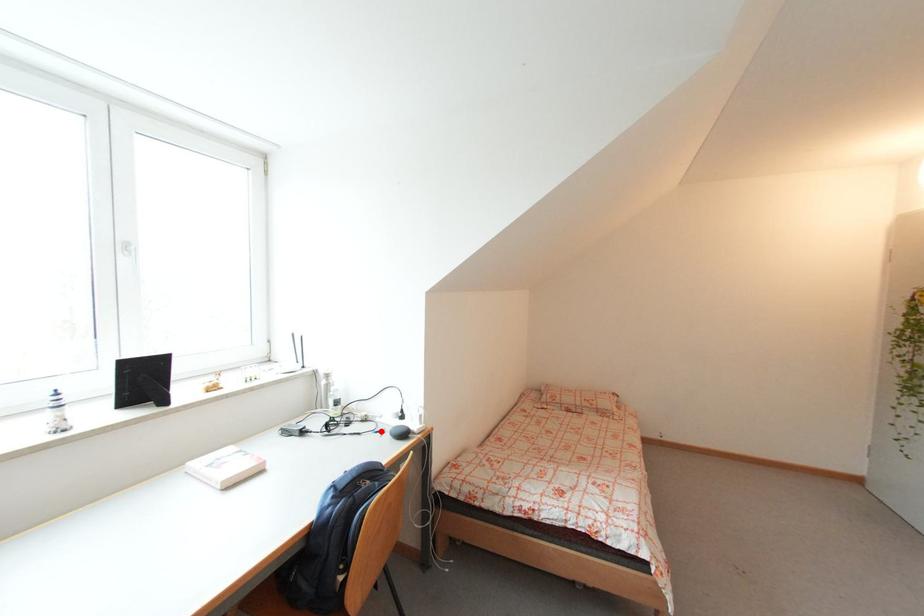
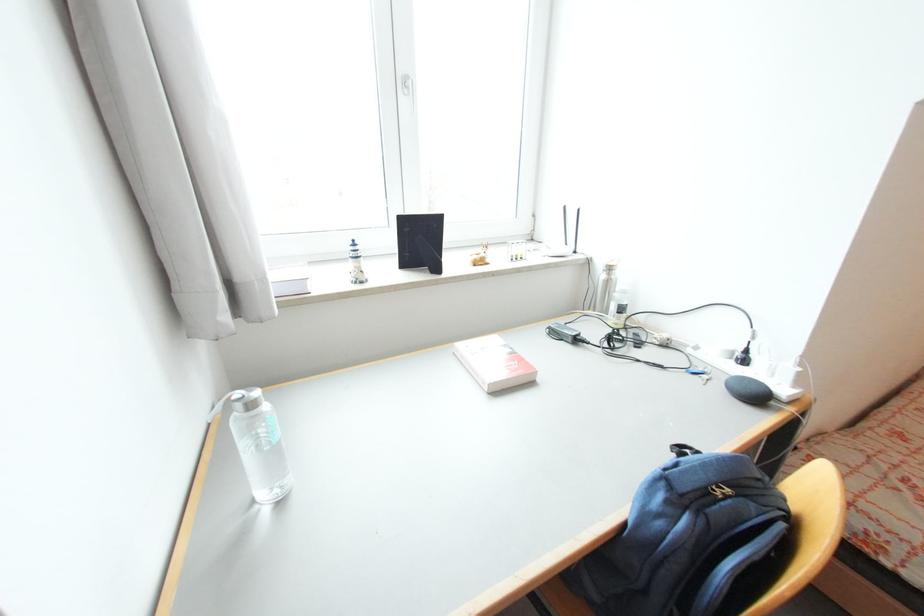
In the second image, find the point that corresponds to the highlighted location in the first image.

(697, 370)